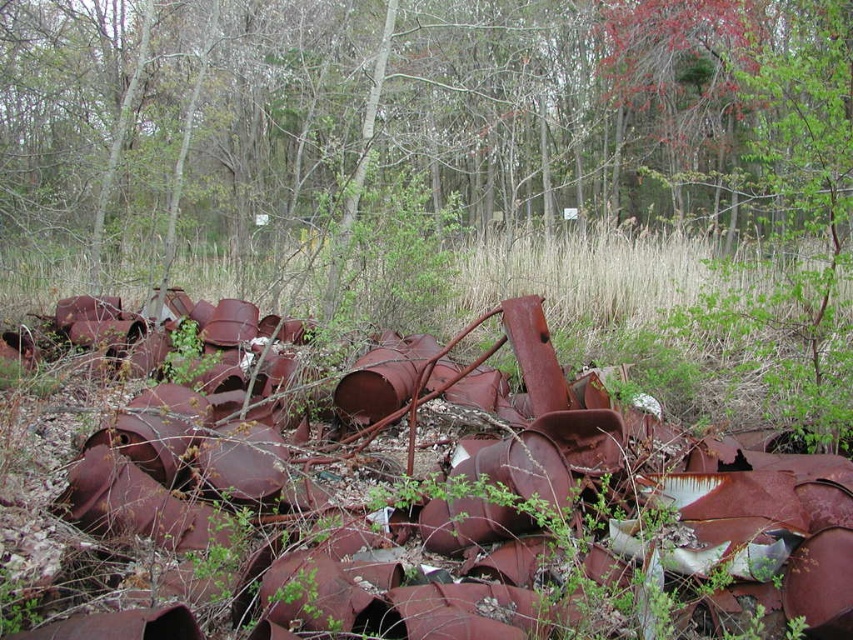
Question: In this image, where is rusty metal pipes at center located relative to brown dry grass at center?

Choices:
 (A) left
 (B) right

Answer: (B)

Question: Which point is farther from the camera taking this photo?

Choices:
 (A) (573, 262)
 (B) (839, 632)

Answer: (A)

Question: Considering the relative positions of rusty metal pipes at center and brown dry grass at center in the image provided, where is rusty metal pipes at center located with respect to brown dry grass at center?

Choices:
 (A) right
 (B) left

Answer: (A)

Question: Does rusty metal pipes at center appear over brown dry grass at center?

Choices:
 (A) no
 (B) yes

Answer: (A)

Question: Which of the following is the farthest from the observer?

Choices:
 (A) (848, 272)
 (B) (791, 470)

Answer: (A)

Question: Which of the following is the farthest from the observer?

Choices:
 (A) (553, 506)
 (B) (840, 291)

Answer: (B)